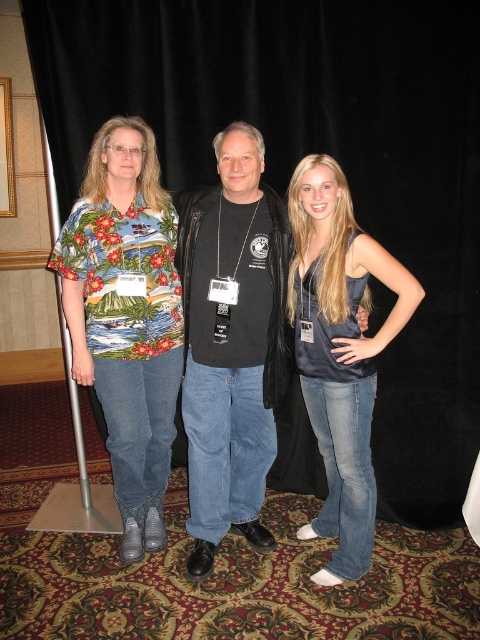
Is floral print shirt at left shorter than satin blue tank top at center?

In fact, floral print shirt at left may be taller than satin blue tank top at center.

Does point (162, 520) come in front of point (308, 180)?

No, (162, 520) is further to viewer.

Locate an element on the screen. floral print shirt at left is located at coordinates (127, 317).

This screenshot has width=480, height=640. I want to click on floral print shirt at left, so click(127, 317).

Describe the element at coordinates (127, 317) in the screenshot. I see `floral print shirt at left` at that location.

Where is `floral print shirt at left`? floral print shirt at left is located at coordinates (127, 317).

Consider the image. Is black matte shirt at center shorter than silver metallic pole at left?

Indeed, black matte shirt at center has a lesser height compared to silver metallic pole at left.

Who is more distant from viewer, (x=227, y=244) or (x=60, y=285)?

The point (x=60, y=285) is behind.

Find the location of `black matte shirt at center`. black matte shirt at center is located at coordinates tap(231, 342).